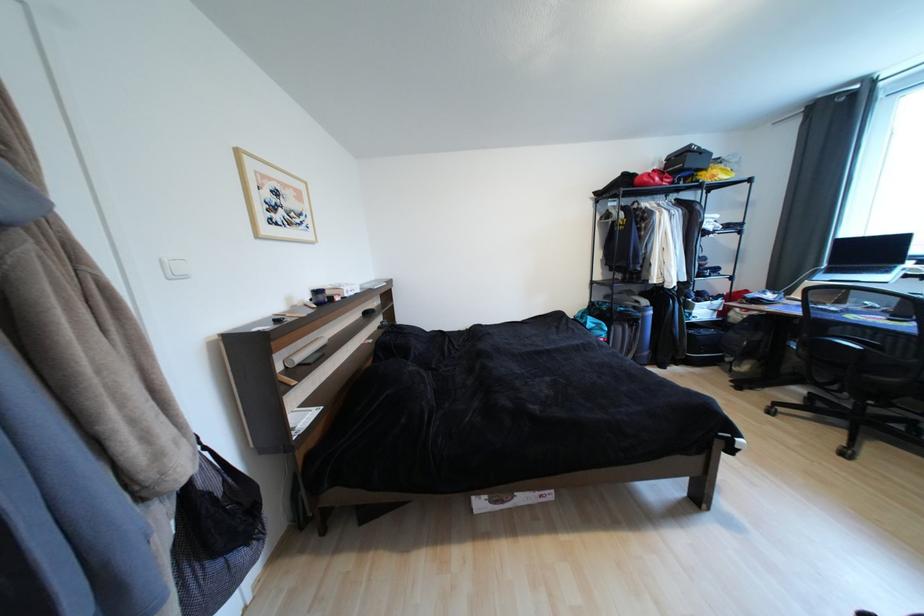
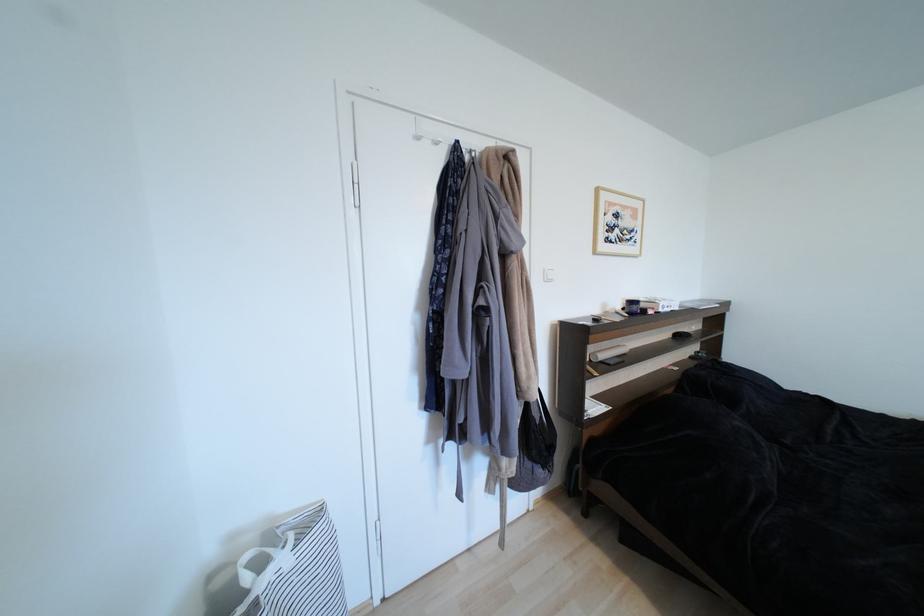
Find the pixel in the second image that matches point (283, 195) in the first image.

(623, 217)